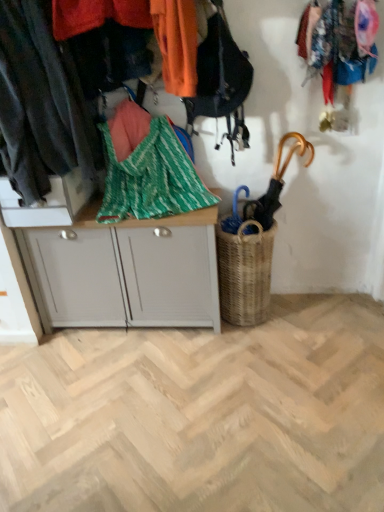
Question: Can you confirm if dark gray fabric at left, the second clothing in the right-to-left sequence, is thinner than woven brown basket at center-right?

Choices:
 (A) yes
 (B) no

Answer: (B)

Question: Is woven brown basket at center-right a part of dark gray fabric at left, which is the first clothing from left to right?

Choices:
 (A) no
 (B) yes

Answer: (A)

Question: From the image's perspective, is dark gray fabric at left, which is the first clothing from left to right, beneath woven brown basket at center-right?

Choices:
 (A) no
 (B) yes

Answer: (A)

Question: Are dark gray fabric at left, which is the first clothing from left to right, and woven brown basket at center-right located far from each other?

Choices:
 (A) no
 (B) yes

Answer: (A)

Question: Is dark gray fabric at left, the second clothing in the right-to-left sequence, bigger than woven brown basket at center-right?

Choices:
 (A) no
 (B) yes

Answer: (B)

Question: Is wooden umbrella at right taller or shorter than white matte cabinet at center?

Choices:
 (A) tall
 (B) short

Answer: (B)

Question: Would you say wooden umbrella at right is to the left or to the right of white matte cabinet at center in the picture?

Choices:
 (A) right
 (B) left

Answer: (A)

Question: Is wooden umbrella at right inside or outside of white matte cabinet at center?

Choices:
 (A) inside
 (B) outside

Answer: (B)

Question: From a real-world perspective, is wooden umbrella at right physically located above or below white matte cabinet at center?

Choices:
 (A) above
 (B) below

Answer: (A)

Question: Considering the positions of dark gray fabric at left, which is the first clothing from left to right, and green woven blanket at center in the image, is dark gray fabric at left, which is the first clothing from left to right, wider or thinner than green woven blanket at center?

Choices:
 (A) wide
 (B) thin

Answer: (A)

Question: From a real-world perspective, relative to green woven blanket at center, is dark gray fabric at left, which is the first clothing from left to right, vertically above or below?

Choices:
 (A) above
 (B) below

Answer: (A)

Question: Considering the relative positions of dark gray fabric at left, the second clothing in the right-to-left sequence, and green woven blanket at center in the image provided, is dark gray fabric at left, the second clothing in the right-to-left sequence, to the left or to the right of green woven blanket at center?

Choices:
 (A) left
 (B) right

Answer: (A)

Question: Does point (34, 66) appear closer or farther from the camera than point (160, 177)?

Choices:
 (A) farther
 (B) closer

Answer: (B)

Question: Considering the positions of dark gray fabric at left, which is the first clothing from left to right, and white matte cabinet at center in the image, is dark gray fabric at left, which is the first clothing from left to right, taller or shorter than white matte cabinet at center?

Choices:
 (A) tall
 (B) short

Answer: (A)

Question: Relative to white matte cabinet at center, is dark gray fabric at left, the second clothing in the right-to-left sequence, in front or behind?

Choices:
 (A) behind
 (B) front

Answer: (B)